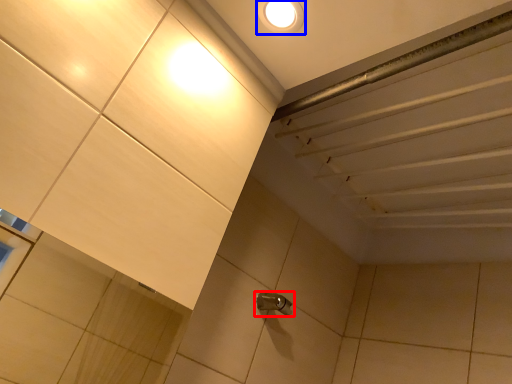
Question: Which point is closer to the camera, plumbing fixture (highlighted by a red box) or droplight (highlighted by a blue box)?

Choices:
 (A) plumbing fixture
 (B) droplight

Answer: (B)